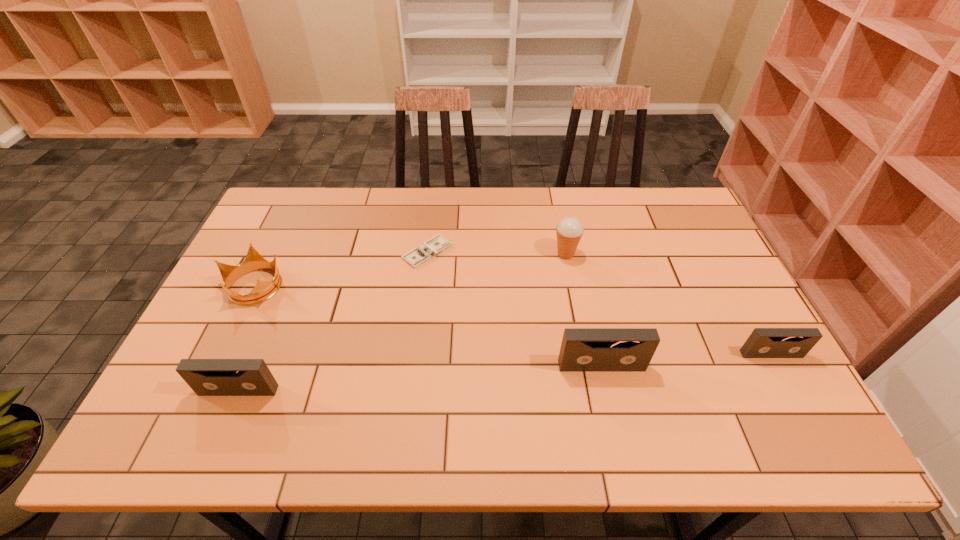
If equal spacing is desired by inserting an extra videotape among them, please point out a free spot for this new videotape. Please provide its 2D coordinates. Your answer should be formatted as a tuple, i.e. [(x, y)], where the tuple contains the x and y coordinates of a point satisfying the conditions above.

[(424, 378)]